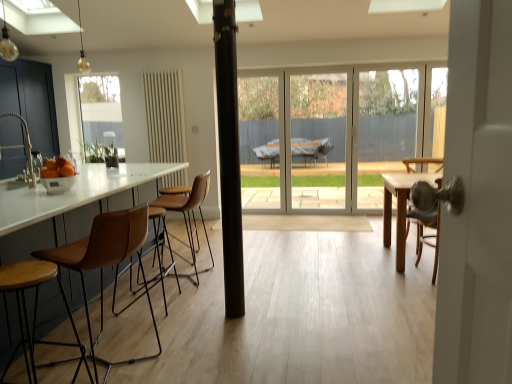
Locate an element on the screen. This screenshot has height=384, width=512. free space in front of black matte pole at center is located at coordinates (237, 322).